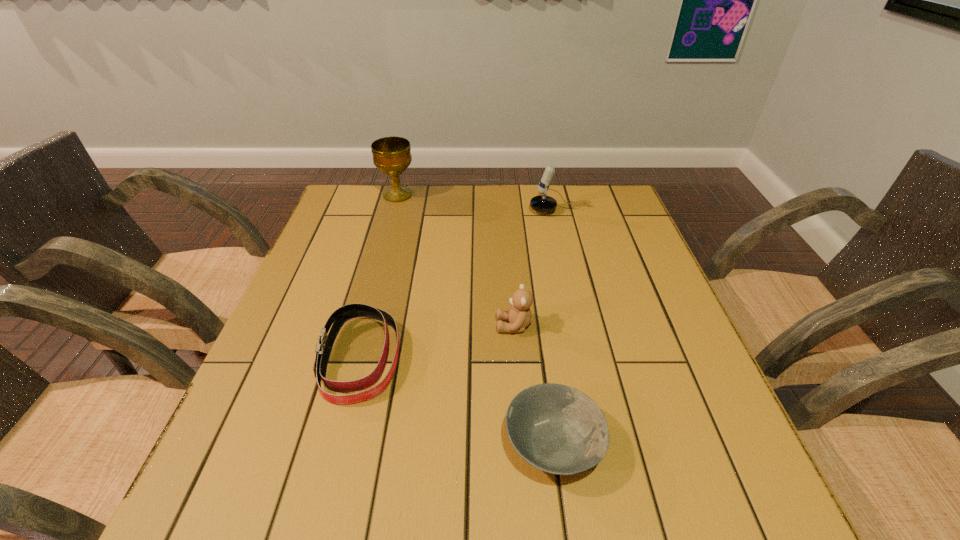
This screenshot has height=540, width=960. In the image, there is a desktop. Identify the location of vacant space at the far edge. (560, 196).

Where is `free spot at the left edge of the desktop`? This screenshot has width=960, height=540. free spot at the left edge of the desktop is located at coordinates (278, 349).

At what (x,y) coordinates should I click in order to perform the action: click on blank space at the right edge. Please return your answer as a coordinate pair (x, y). Looking at the image, I should click on (667, 359).

Identify the location of blank space at the far left corner of the desktop. (342, 202).

Locate an element on the screen. The image size is (960, 540). free region at the far right corner is located at coordinates (596, 193).

Identify the location of vacant space that's between the dog collar and the chalice. (379, 276).

This screenshot has width=960, height=540. I want to click on free point between the dog collar and the microphone, so click(x=461, y=285).

The width and height of the screenshot is (960, 540). I want to click on free space between the microphone and the third shortest object, so click(x=539, y=268).

Where is `free space between the shortest object and the teddy bear`? The width and height of the screenshot is (960, 540). free space between the shortest object and the teddy bear is located at coordinates (534, 384).

Where is `free spot between the dog collar and the teddy bear`? This screenshot has width=960, height=540. free spot between the dog collar and the teddy bear is located at coordinates (437, 342).